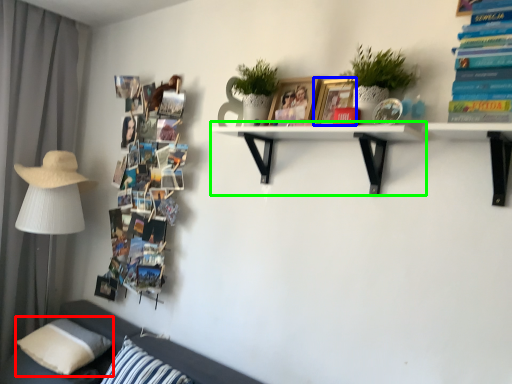
Question: Based on their relative distances, which object is farther from pillow (highlighted by a red box)? Choose from picture frame (highlighted by a blue box) and shelf (highlighted by a green box).

Choices:
 (A) picture frame
 (B) shelf

Answer: (A)